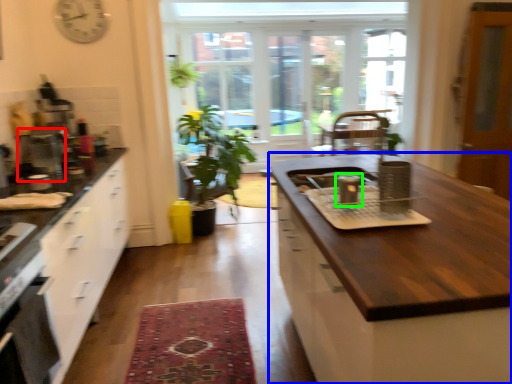
Question: Which object is the closest to the appliance (highlighted by a red box)? Choose among these: cabinetry (highlighted by a blue box) or appliance (highlighted by a green box).

Choices:
 (A) cabinetry
 (B) appliance

Answer: (B)